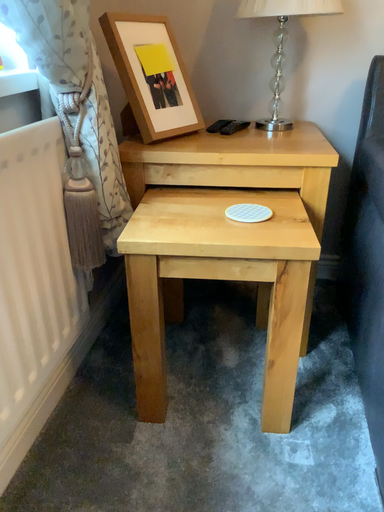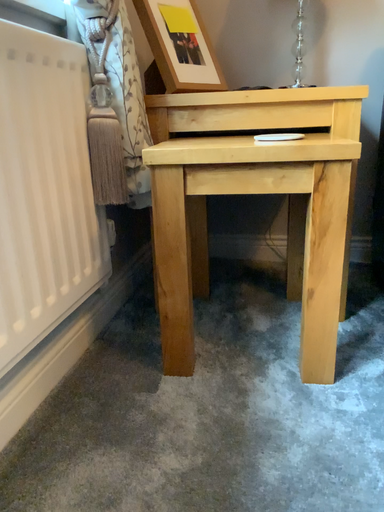
Question: Which way did the camera rotate in the video?

Choices:
 (A) rotated upward
 (B) rotated downward

Answer: (A)